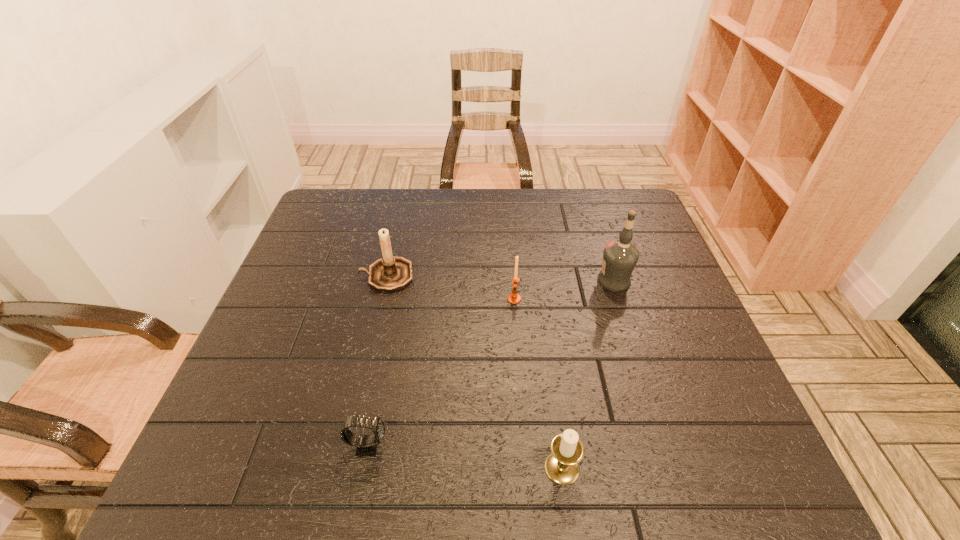
You are a GUI agent. You are given a task and a screenshot of the screen. Output one action in this format:
    pyautogui.click(x=<x>, y=<y>)
    Task: Click on the vacant area between the third object from right to left and the leftmost candle holder
    
    Given the screenshot: What is the action you would take?
    pyautogui.click(x=450, y=287)

You are a GUI agent. You are given a task and a screenshot of the screen. Output one action in this format:
    pyautogui.click(x=<x>, y=<y>)
    Task: Click on the vacant area that lies between the shortest object and the second shortest object
    
    Given the screenshot: What is the action you would take?
    pyautogui.click(x=465, y=457)

Find the location of a particular element. The image size is (960, 540). free space that is in between the fourth object from left to right and the shortest object is located at coordinates (465, 457).

Where is `empty space that is in between the rightmost object and the leftmost candle holder`? This screenshot has width=960, height=540. empty space that is in between the rightmost object and the leftmost candle holder is located at coordinates (500, 278).

Locate which object ranks in proximity to the shortest candle holder. Please provide its 2D coordinates. Your answer should be formatted as a tuple, i.e. [(x, y)], where the tuple contains the x and y coordinates of a point satisfying the conditions above.

[(366, 446)]

Find the location of a particular element. Image resolution: width=960 pixels, height=540 pixels. object that is the second closest to the shortest object is located at coordinates (389, 274).

In order to click on candle holder that stands as the closest to the watch in this screenshot , I will do `click(562, 465)`.

Locate an element on the screen. The height and width of the screenshot is (540, 960). the second closest candle holder relative to the third object from right to left is located at coordinates (562, 465).

The height and width of the screenshot is (540, 960). I want to click on free space that satisfies the following two spatial constraints: 1. on the front label of the rightmost object; 2. on the front side of the nearest candle holder, so click(674, 468).